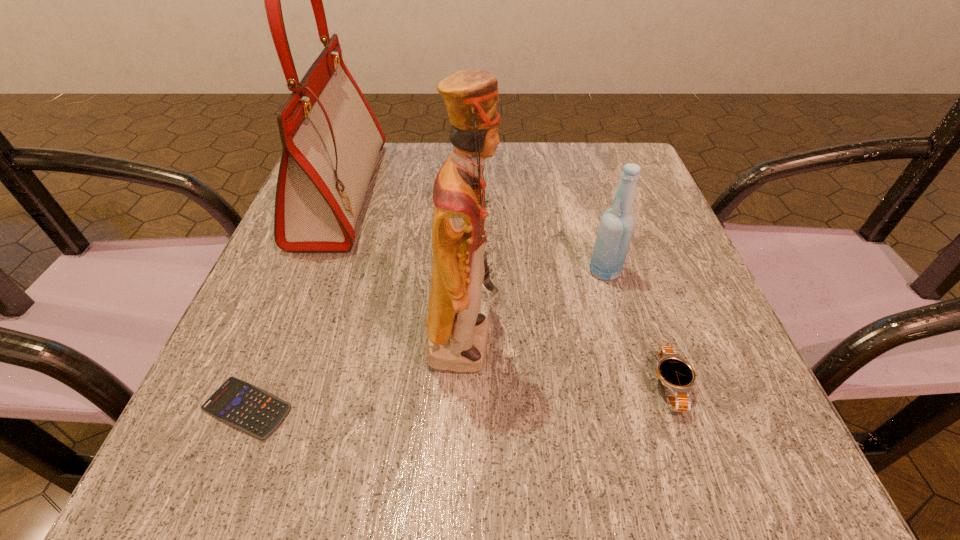
The width and height of the screenshot is (960, 540). In order to click on free space in the image that satisfies the following two spatial constraints: 1. on the front side of the fourth shortest object; 2. on the left side of the second shortest object in this screenshot , I will do `click(637, 386)`.